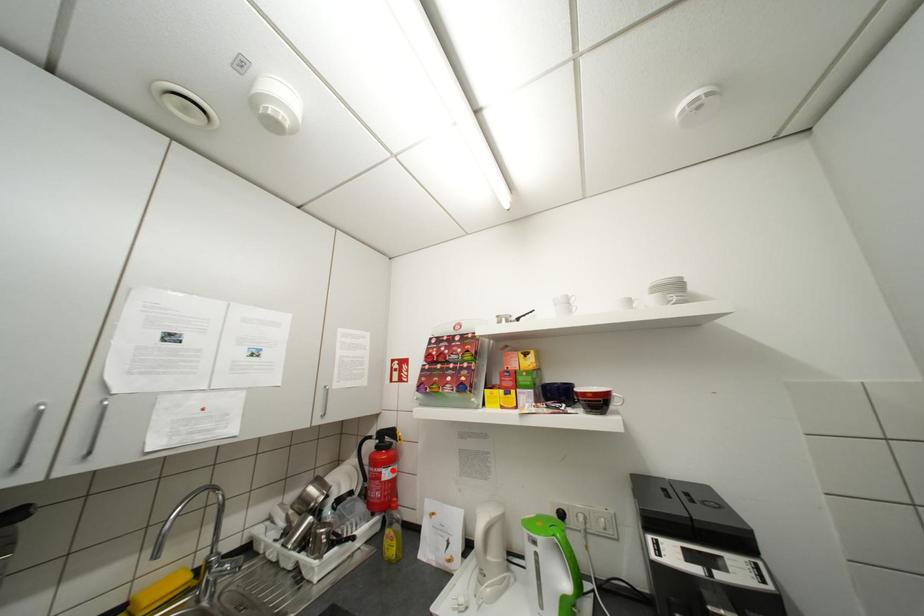
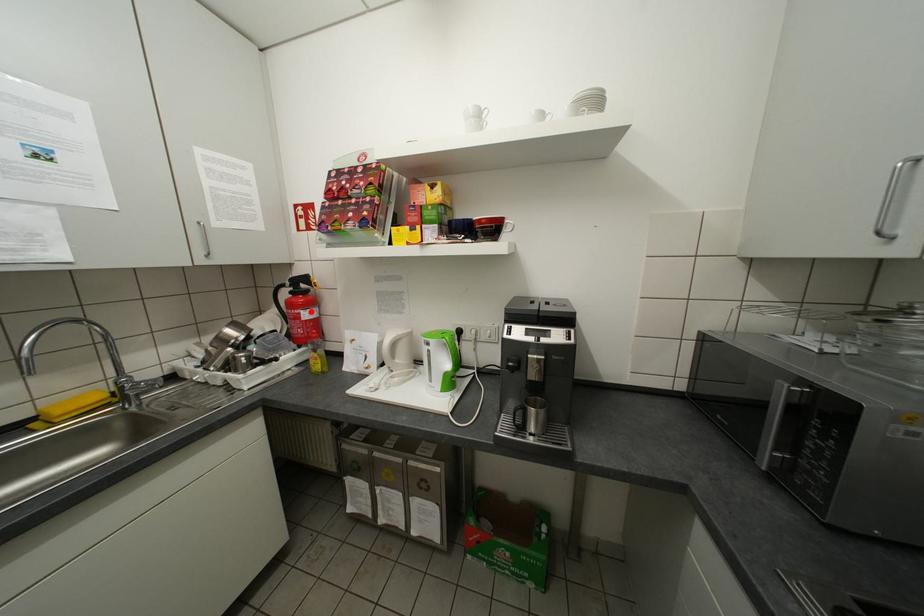
I am providing you with two images of the same scene from different viewpoints. A red point is marked on the first image and another point is marked on the second image. Do the highlighted points in image1 and image2 indicate the same real-world spot?

Yes